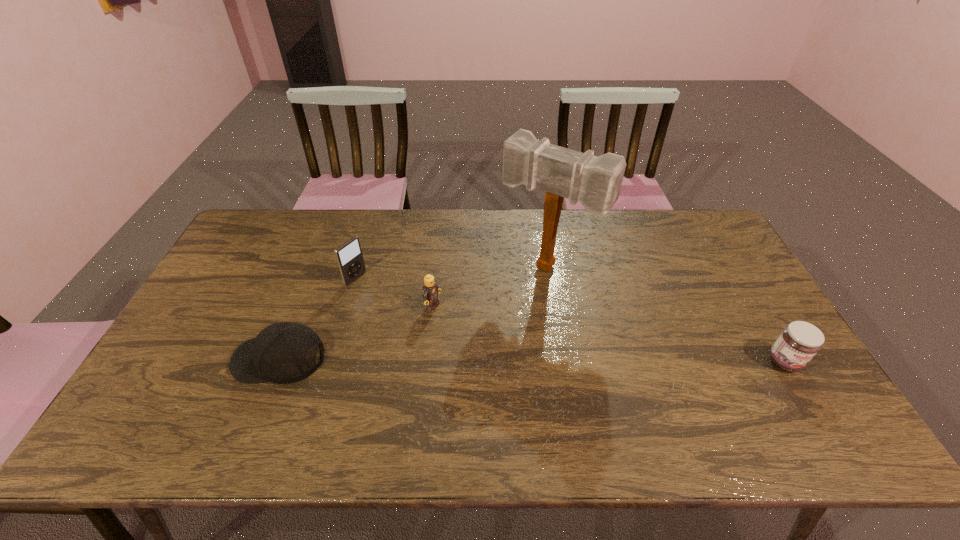
Locate an element on the screen. vacant space located 0.070m on the front label of the rightmost object is located at coordinates (807, 400).

You are a GUI agent. You are given a task and a screenshot of the screen. Output one action in this format:
    pyautogui.click(x=<x>, y=<y>)
    Task: Click on the vacant region located at the head of the mallet
    The height and width of the screenshot is (540, 960).
    Given the screenshot: What is the action you would take?
    pyautogui.click(x=516, y=300)

What are the coordinates of `vacant space located 0.220m at the head of the mallet` in the screenshot? It's located at (487, 339).

You are a GUI agent. You are given a task and a screenshot of the screen. Output one action in this format:
    pyautogui.click(x=<x>, y=<y>)
    Task: Click on the free location located at the head of the mallet
    
    Given the screenshot: What is the action you would take?
    pyautogui.click(x=450, y=387)

Where is `vacant area situated on the front-facing side of the second tallest object`? The width and height of the screenshot is (960, 540). vacant area situated on the front-facing side of the second tallest object is located at coordinates (466, 342).

Identify the location of blank space located on the front-facing side of the second tallest object. This screenshot has width=960, height=540. (457, 337).

Locate an element on the screen. free space located 0.330m on the front-facing side of the second tallest object is located at coordinates (445, 330).

Identify the location of vacant space located in front of the third object from left to right. (542, 366).

Locate an element on the screen. blank space located 0.050m in front of the third object from left to right is located at coordinates (453, 318).

Locate an element on the screen. The image size is (960, 540). vacant position located 0.120m in front of the third object from left to right is located at coordinates (473, 329).